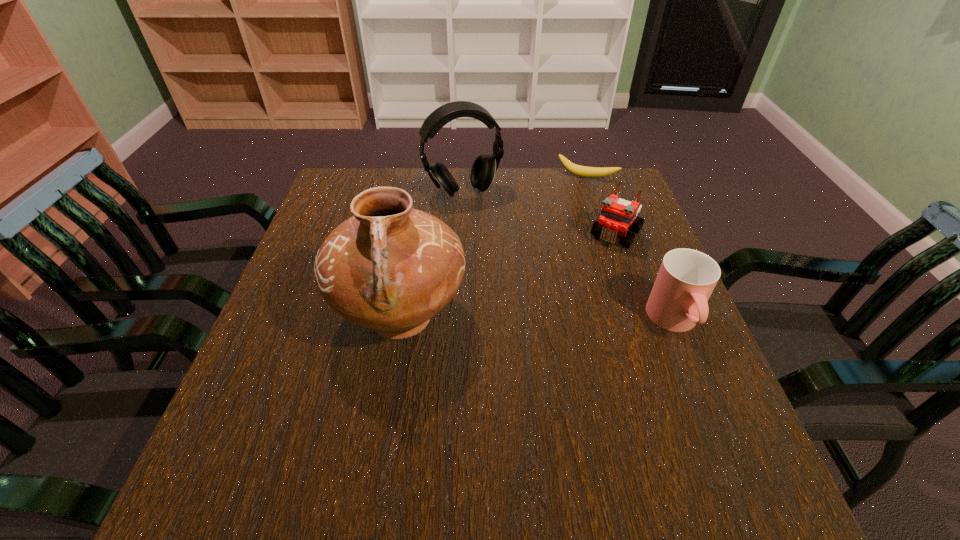
This screenshot has width=960, height=540. Find the location of `vacant region located on the upward curve of the banana`. vacant region located on the upward curve of the banana is located at coordinates (558, 235).

At what (x,y) coordinates should I click in order to perform the action: click on vacant area situated on the upward curve of the banana. Please return your answer as a coordinate pair (x, y). Looking at the image, I should click on (547, 261).

Locate an element on the screen. free location located 0.350m on the upward curve of the banana is located at coordinates (550, 253).

At what (x,y) coordinates should I click in order to perform the action: click on blank space located on the ear cups of the earphone. Please return your answer as a coordinate pair (x, y). The height and width of the screenshot is (540, 960). Looking at the image, I should click on (484, 221).

At what (x,y) coordinates should I click in order to perform the action: click on vacant space located 0.150m on the ear cups of the earphone. Please return your answer as a coordinate pair (x, y). This screenshot has width=960, height=540. Looking at the image, I should click on (492, 237).

The width and height of the screenshot is (960, 540). Identify the location of free space located 0.400m on the ear cups of the earphone. (529, 303).

Locate an element on the screen. The width and height of the screenshot is (960, 540). banana that is at the far edge is located at coordinates (583, 171).

Where is `earphone positioned at the far edge`? earphone positioned at the far edge is located at coordinates (484, 167).

The height and width of the screenshot is (540, 960). In order to click on object at the left edge in this screenshot , I will do `click(391, 268)`.

Identify the location of cup present at the right edge. (678, 301).